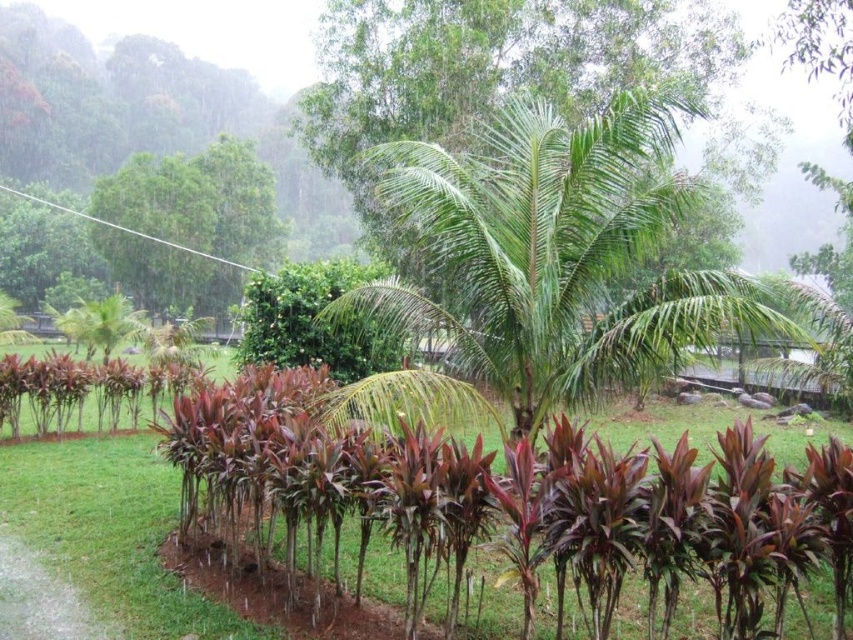
You are standing in the tropical garden and want to take a photo of the green leafy palm at center. If your camera has a maximum focus range of 6 meters, will it be able to capture the palm clearly?

The green leafy palm at center is 6.53 meters away from the camera, which exceeds the maximum focus range of 6 meters. Therefore, the camera may not be able to capture the palm clearly.